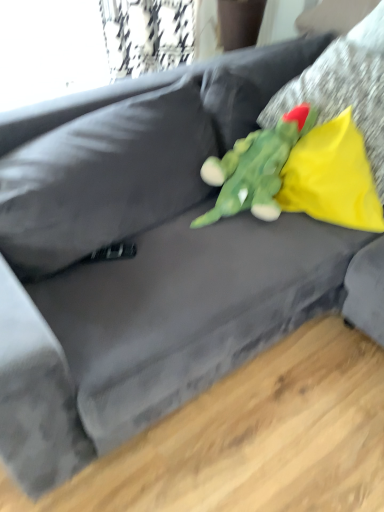
Question: Considering the relative positions of yellow fabric pillow at upper right, positioned as the 2th pillow in top-to-bottom order, and yellow fabric pillow at upper right, which ranks as the 2th pillow in bottom-to-top order, in the image provided, is yellow fabric pillow at upper right, positioned as the 2th pillow in top-to-bottom order, to the right of yellow fabric pillow at upper right, which ranks as the 2th pillow in bottom-to-top order, from the viewer's perspective?

Choices:
 (A) no
 (B) yes

Answer: (A)

Question: Is yellow fabric pillow at upper right, the 1th pillow in the bottom-to-top sequence, directly adjacent to yellow fabric pillow at upper right, which ranks as the 2th pillow in bottom-to-top order?

Choices:
 (A) no
 (B) yes

Answer: (A)

Question: Is yellow fabric pillow at upper right, positioned as the 2th pillow in top-to-bottom order, smaller than yellow fabric pillow at upper right, which ranks as the 2th pillow in bottom-to-top order?

Choices:
 (A) yes
 (B) no

Answer: (A)

Question: Is yellow fabric pillow at upper right, positioned as the 2th pillow in top-to-bottom order, outside yellow fabric pillow at upper right, which ranks as the 2th pillow in bottom-to-top order?

Choices:
 (A) no
 (B) yes

Answer: (B)

Question: From a real-world perspective, is yellow fabric pillow at upper right, the 1th pillow in the bottom-to-top sequence, over yellow fabric pillow at upper right, which ranks as the first pillow in top-to-bottom order?

Choices:
 (A) no
 (B) yes

Answer: (A)

Question: Would you say yellow fabric pillow at upper right, which ranks as the first pillow in top-to-bottom order, is inside or outside green plush toy at center?

Choices:
 (A) inside
 (B) outside

Answer: (B)

Question: From the image's perspective, is yellow fabric pillow at upper right, which ranks as the first pillow in top-to-bottom order, located above or below green plush toy at center?

Choices:
 (A) above
 (B) below

Answer: (A)

Question: In terms of height, does yellow fabric pillow at upper right, which ranks as the 2th pillow in bottom-to-top order, look taller or shorter compared to green plush toy at center?

Choices:
 (A) short
 (B) tall

Answer: (B)

Question: Is yellow fabric pillow at upper right, which ranks as the first pillow in top-to-bottom order, in front of or behind green plush toy at center in the image?

Choices:
 (A) behind
 (B) front

Answer: (A)

Question: From a real-world perspective, relative to yellow fabric pillow at upper right, which ranks as the 2th pillow in bottom-to-top order, is yellow fabric pillow at upper right, positioned as the 2th pillow in top-to-bottom order, vertically above or below?

Choices:
 (A) above
 (B) below

Answer: (B)

Question: Does point (370, 211) appear closer or farther from the camera than point (292, 99)?

Choices:
 (A) farther
 (B) closer

Answer: (B)

Question: From the image's perspective, is yellow fabric pillow at upper right, the 1th pillow in the bottom-to-top sequence, positioned above or below yellow fabric pillow at upper right, which ranks as the first pillow in top-to-bottom order?

Choices:
 (A) above
 (B) below

Answer: (B)

Question: Based on their sizes in the image, would you say yellow fabric pillow at upper right, the 1th pillow in the bottom-to-top sequence, is bigger or smaller than yellow fabric pillow at upper right, which ranks as the first pillow in top-to-bottom order?

Choices:
 (A) big
 (B) small

Answer: (B)

Question: Is yellow fabric pillow at upper right, the 1th pillow in the bottom-to-top sequence, inside or outside of green plush toy at center?

Choices:
 (A) outside
 (B) inside

Answer: (A)

Question: From a real-world perspective, is yellow fabric pillow at upper right, positioned as the 2th pillow in top-to-bottom order, positioned above or below green plush toy at center?

Choices:
 (A) below
 (B) above

Answer: (A)